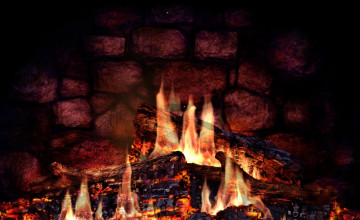
Identify the location of fireplace. This screenshot has height=220, width=360. (227, 92).